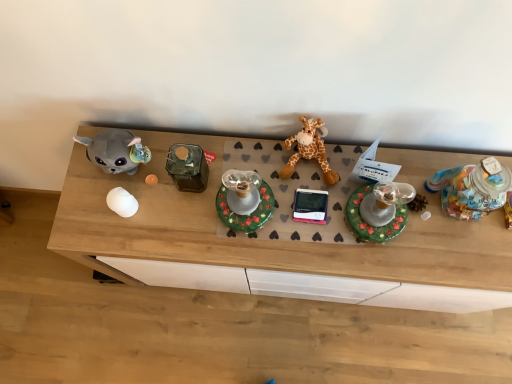
Question: Is orange plush giraffe at center located outside white glossy egg at center, which is the first toy from left to right?

Choices:
 (A) no
 (B) yes

Answer: (B)

Question: From the image's perspective, is orange plush giraffe at center on white glossy egg at center, which is the first toy from left to right?

Choices:
 (A) no
 (B) yes

Answer: (B)

Question: Is orange plush giraffe at center to the right of white glossy egg at center, which is the first toy from left to right, from the viewer's perspective?

Choices:
 (A) no
 (B) yes

Answer: (B)

Question: From a real-world perspective, is orange plush giraffe at center positioned over white glossy egg at center, acting as the 4th toy starting from the right, based on gravity?

Choices:
 (A) yes
 (B) no

Answer: (A)

Question: Is orange plush giraffe at center taller than white glossy egg at center, acting as the 4th toy starting from the right?

Choices:
 (A) yes
 (B) no

Answer: (A)

Question: Do you think white glossy egg at center, which is the first toy from left to right, is within shiny green plastic candle holder at center, which appears as the second toy when viewed from the right, or outside of it?

Choices:
 (A) outside
 (B) inside

Answer: (A)

Question: Considering the positions of white glossy egg at center, acting as the 4th toy starting from the right, and shiny green plastic candle holder at center, which appears as the second toy when viewed from the right, in the image, is white glossy egg at center, acting as the 4th toy starting from the right, taller or shorter than shiny green plastic candle holder at center, which appears as the second toy when viewed from the right,?

Choices:
 (A) short
 (B) tall

Answer: (A)

Question: Considering their positions, is white glossy egg at center, acting as the 4th toy starting from the right, located in front of or behind shiny green plastic candle holder at center, which is the 3th toy from left to right?

Choices:
 (A) front
 (B) behind

Answer: (B)

Question: Does point (122, 198) appear closer or farther from the camera than point (382, 228)?

Choices:
 (A) farther
 (B) closer

Answer: (A)

Question: From the image's perspective, is orange plush giraffe at center located above or below translucent plastic jar at right, positioned as the first toy in right-to-left order?

Choices:
 (A) above
 (B) below

Answer: (A)

Question: In the image, is orange plush giraffe at center on the left side or the right side of translucent plastic jar at right, positioned as the first toy in right-to-left order?

Choices:
 (A) right
 (B) left

Answer: (B)

Question: Is orange plush giraffe at center wider or thinner than translucent plastic jar at right, positioned as the first toy in right-to-left order?

Choices:
 (A) thin
 (B) wide

Answer: (A)

Question: From a real-world perspective, is orange plush giraffe at center physically located above or below translucent plastic jar at right, positioned as the fourth toy in left-to-right order?

Choices:
 (A) above
 (B) below

Answer: (B)

Question: Considering their positions, is orange plush giraffe at center located in front of or behind green matte candle holder at center, which is the third toy from right to left?

Choices:
 (A) front
 (B) behind

Answer: (B)

Question: Considering the positions of orange plush giraffe at center and green matte candle holder at center, which is the third toy from right to left, in the image, is orange plush giraffe at center bigger or smaller than green matte candle holder at center, which is the third toy from right to left,?

Choices:
 (A) big
 (B) small

Answer: (B)